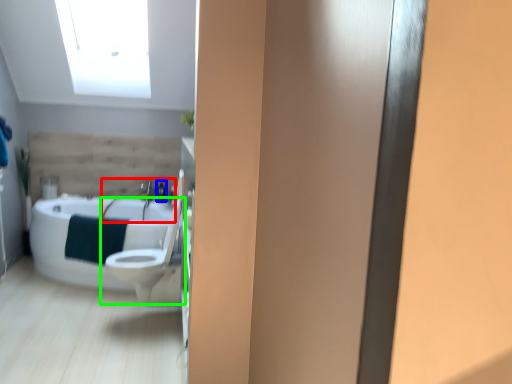
Question: Which object is the closest to the sink (highlighted by a red box)? Choose among these: toiletry (highlighted by a blue box) or toilet (highlighted by a green box).

Choices:
 (A) toiletry
 (B) toilet

Answer: (A)